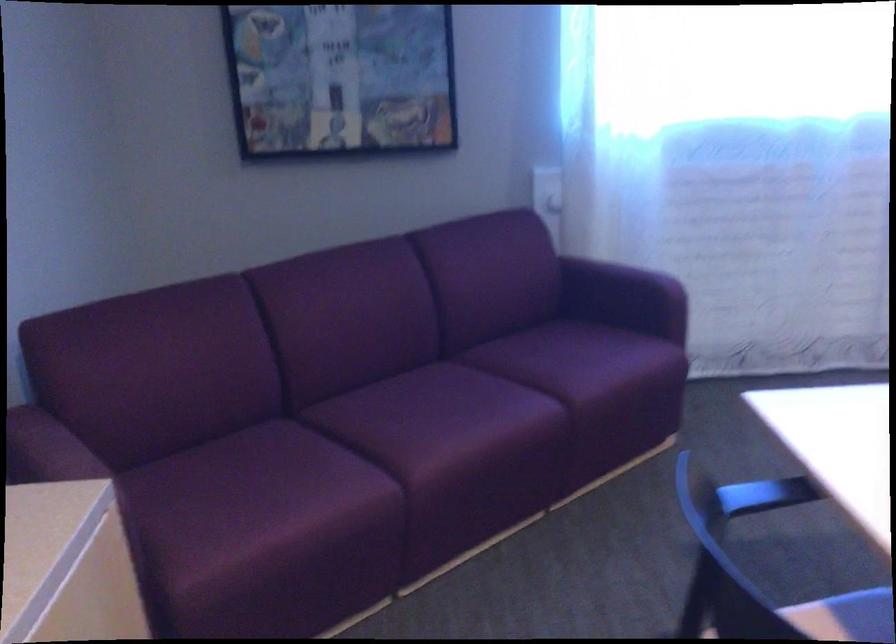
The width and height of the screenshot is (896, 644). Identify the location of purple sofa sitting surface. (445, 422).